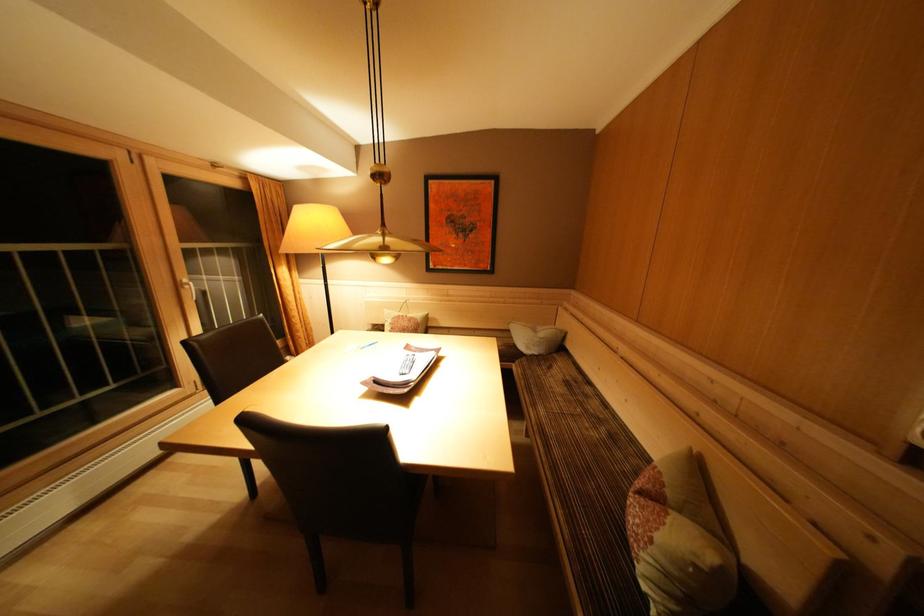
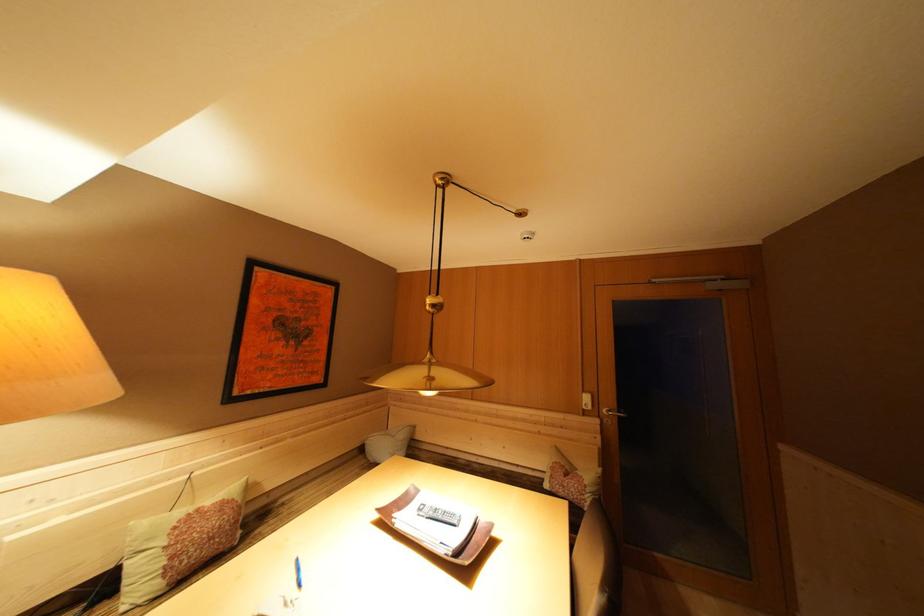
The point at (x=409, y=321) is marked in the first image. Where is the corresponding point in the second image?

(204, 515)